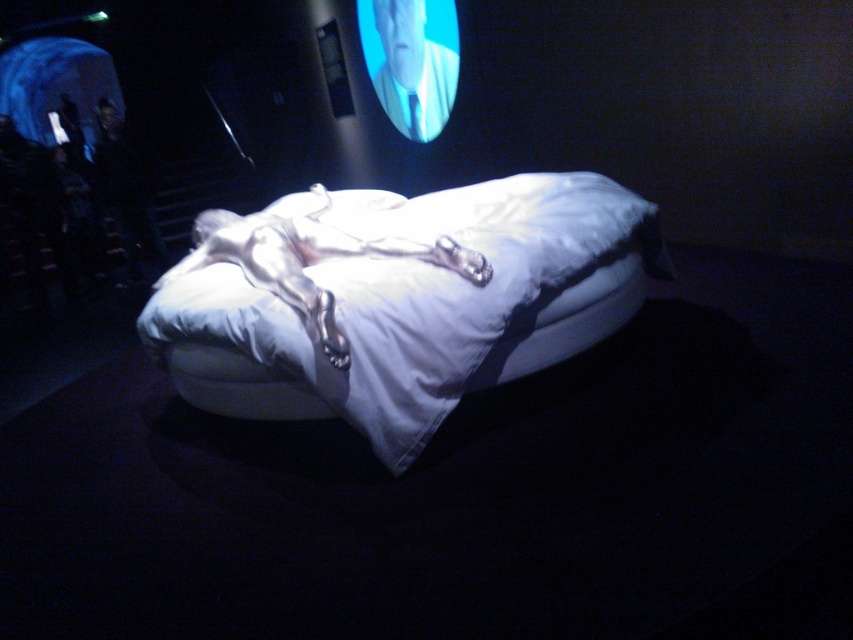
Does white fabric bed at center have a lesser height compared to silver metallic sleeping bag at center?

In fact, white fabric bed at center may be taller than silver metallic sleeping bag at center.

Is point (393, 344) closer to viewer compared to point (309, 220)?

Yes.

Image resolution: width=853 pixels, height=640 pixels. What are the coordinates of `white fabric bed at center` in the screenshot? It's located at (407, 294).